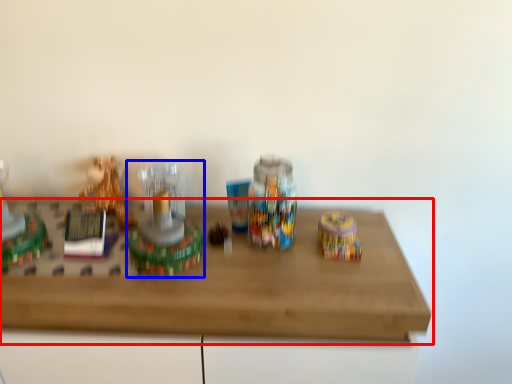
Question: Among these objects, which one is farthest to the camera, table (highlighted by a red box) or toy (highlighted by a blue box)?

Choices:
 (A) table
 (B) toy

Answer: (B)